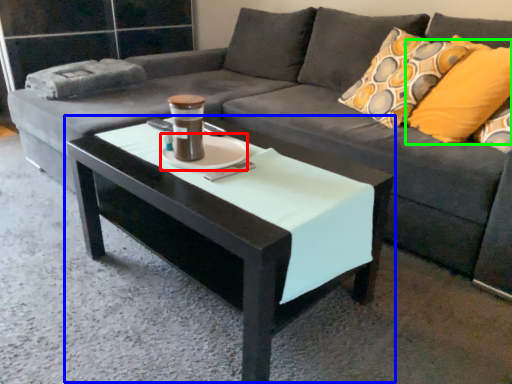
Question: Based on their relative distances, which object is farther from saucer (highlighted by a red box)? Choose from coffee table (highlighted by a blue box) and pillow (highlighted by a green box).

Choices:
 (A) coffee table
 (B) pillow

Answer: (B)